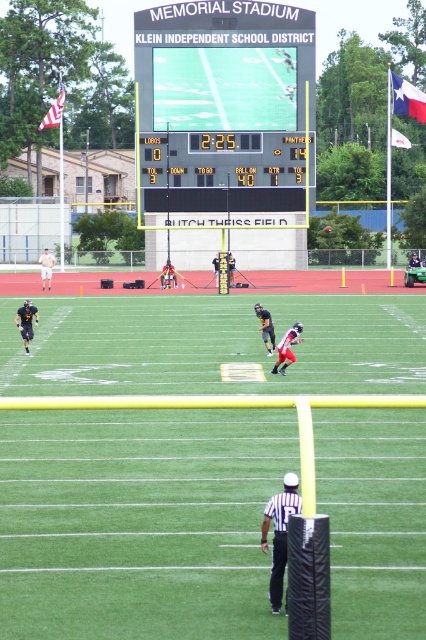
Between black jersey at center and dark blue uniform at center, which one has less height?

black jersey at center

Does black jersey at center have a lesser height compared to dark blue uniform at center?

Yes.

What do you see at coordinates (287, 348) in the screenshot? The image size is (426, 640). I see `black jersey at center` at bounding box center [287, 348].

You are a GUI agent. You are given a task and a screenshot of the screen. Output one action in this format:
    pyautogui.click(x=<x>, y=<y>)
    Task: Click on the black jersey at center
    
    Given the screenshot: What is the action you would take?
    pyautogui.click(x=287, y=348)

Who is lower down, dark blue uniform at center or black uniformed person at center?

black uniformed person at center

From the picture: Does dark blue uniform at center appear over black uniformed person at center?

Indeed, dark blue uniform at center is positioned over black uniformed person at center.

Describe the element at coordinates (414, 260) in the screenshot. I see `dark blue uniform at center` at that location.

Find the location of `dark blue uniform at center`. dark blue uniform at center is located at coordinates (414, 260).

Identify the location of black uniform at left. (25, 321).

Can you confirm if black uniform at left is shorter than matte black uniform at center?

Yes, black uniform at left is shorter than matte black uniform at center.

At what (x,y) coordinates should I click in order to perform the action: click on black uniform at left. Please return your answer as a coordinate pair (x, y). The height and width of the screenshot is (640, 426). Looking at the image, I should click on (25, 321).